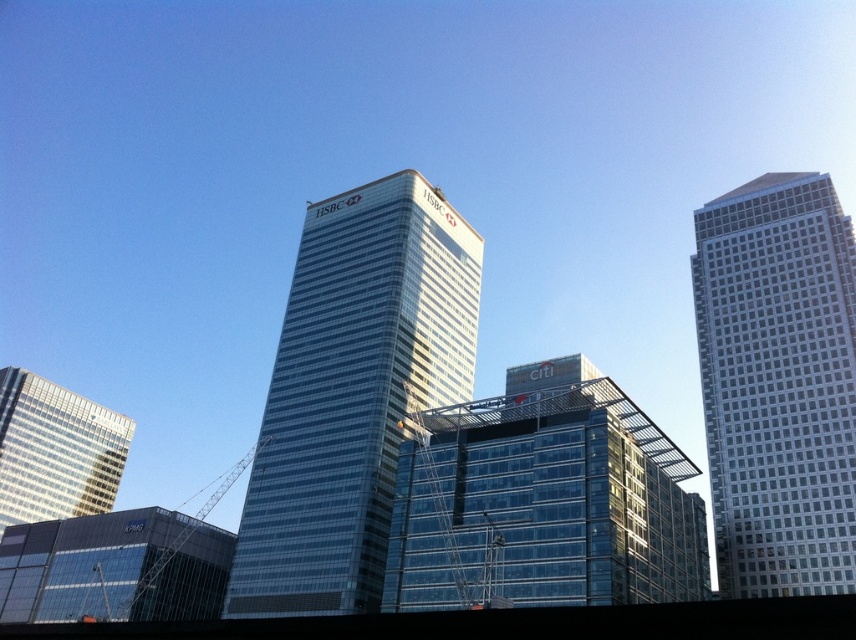
You are a drone operator tasked with capturing aerial footage of the glassy skyscraper at center and the transparent glass building at center. From your current position, which one is higher in the frame?

The glassy skyscraper at center is located above the transparent glass building at center, so it is higher in the frame.

You are a city planner assessing the skyline for potential solar panel installations. You notice the transparent glass building at lower left and the glassy reflective skyscraper at lower left. Which of these two buildings might have a larger surface area on their facades suitable for solar panels?

The transparent glass building at lower left might be wider than glassy reflective skyscraper at lower left, so it could have a larger facade surface area suitable for solar panels.

You are a drone operator tasked with capturing aerial footage of the transparent glass building at lower left and the glassy reflective skyscraper at lower left. Your drone has a maximum flight range of 50 meters. Can you fly the drone from one building to the other without exceeding its range?

The transparent glass building at lower left is 52.78 meters away from the glassy reflective skyscraper at lower left. Since the drone has a maximum flight range of 50 meters, it cannot fly between them without exceeding its range.